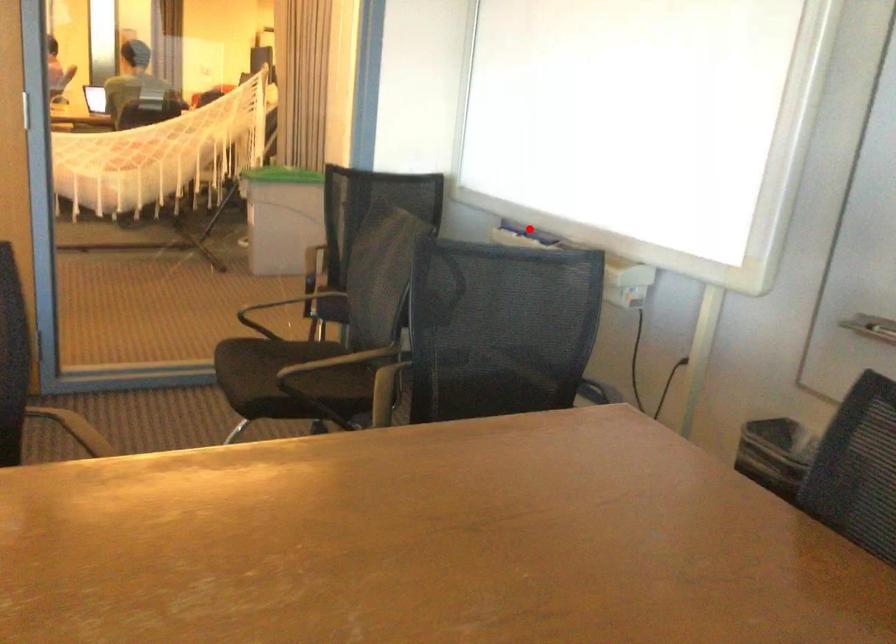
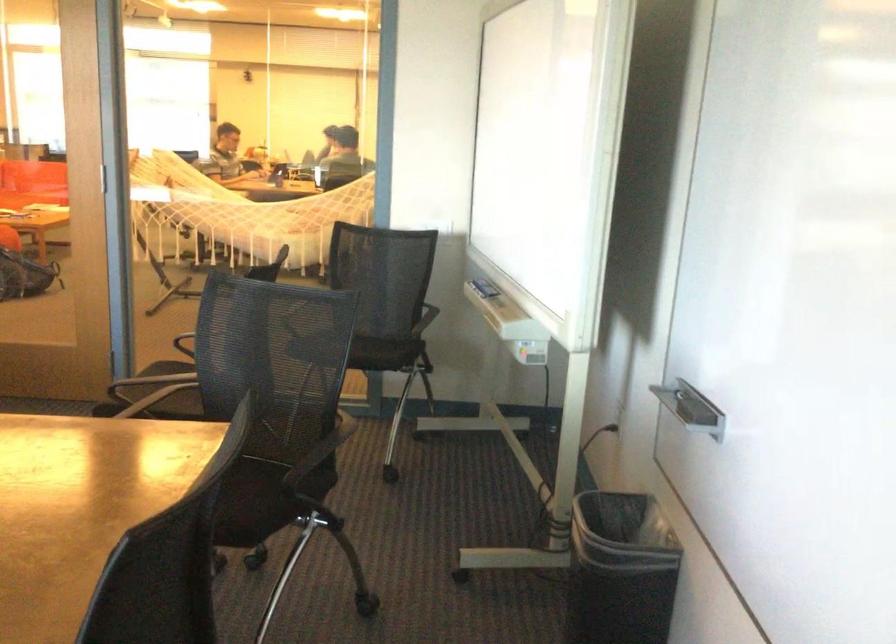
Find the pixel in the second image that matches the highlighted location in the first image.

(484, 288)